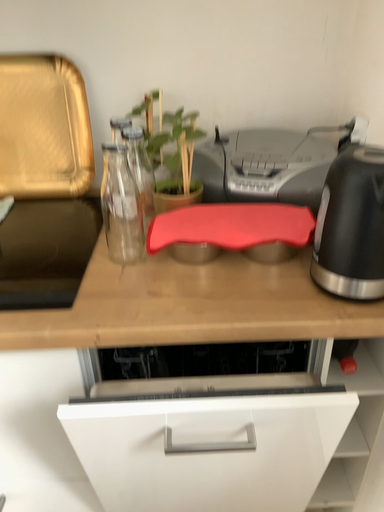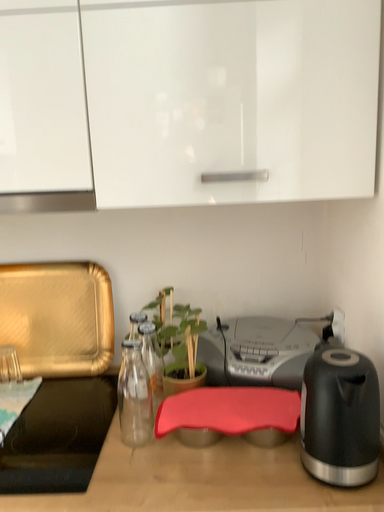
Question: Which way did the camera rotate in the video?

Choices:
 (A) rotated downward
 (B) rotated upward

Answer: (B)